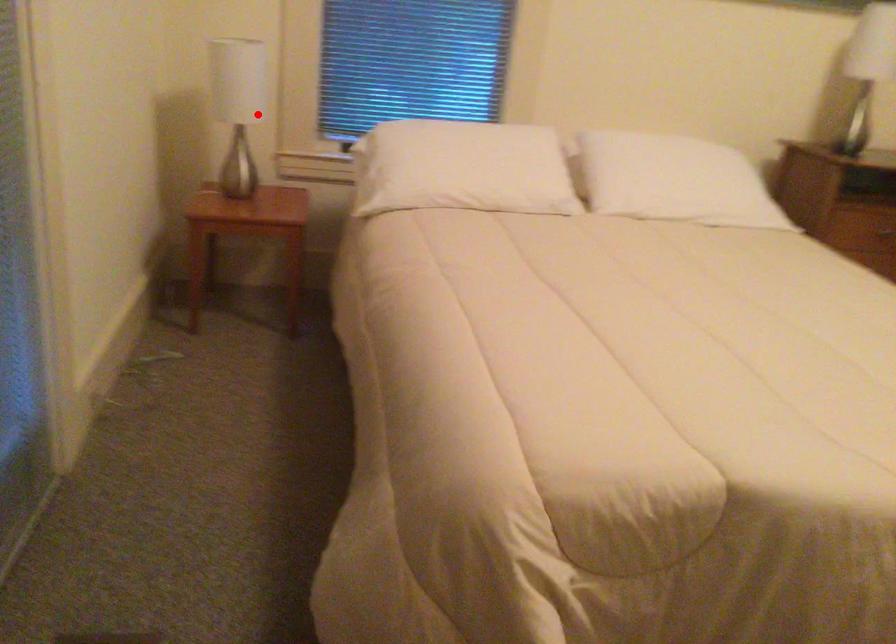
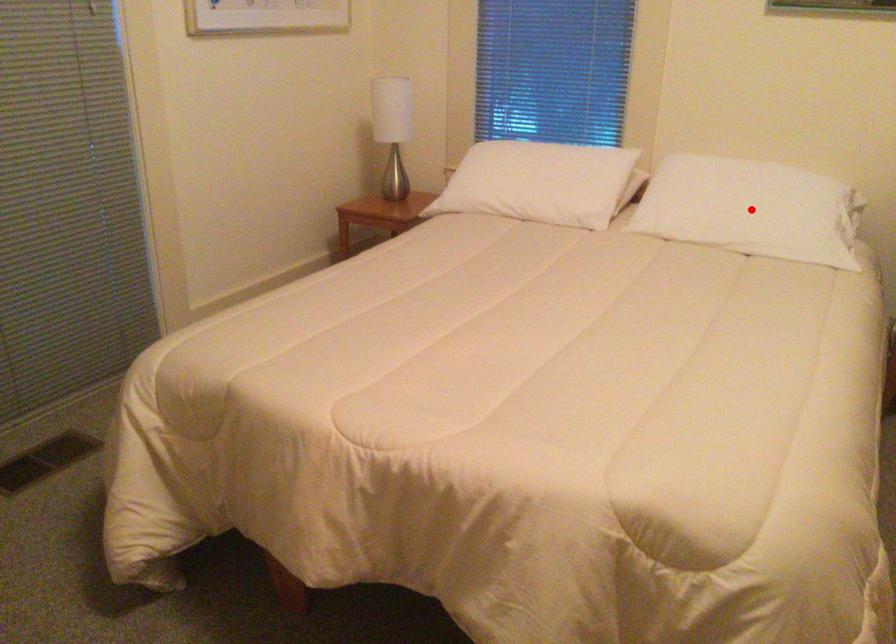
I am providing you with two images of the same scene from different viewpoints. A red point is marked on the first image and another point is marked on the second image. Are the points marked in image1 and image2 representing the same 3D position?

No